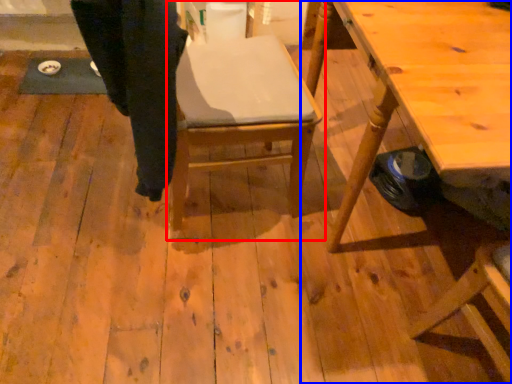
Question: Which of the following is the closest to the observer, chair (highlighted by a red box) or table (highlighted by a blue box)?

Choices:
 (A) chair
 (B) table

Answer: (B)